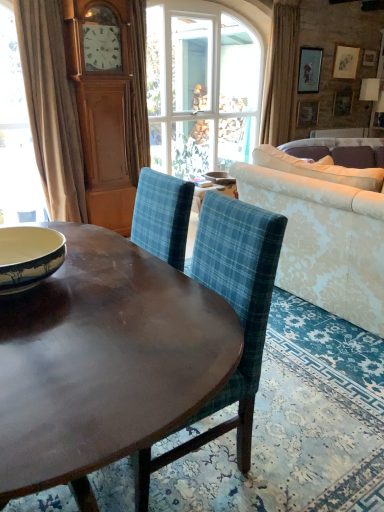
Question: Do you think shiny brown wood coffee table at center is within wooden picture frame at upper right, the 1th picture frame from the bottom, or outside of it?

Choices:
 (A) inside
 (B) outside

Answer: (B)

Question: From the image's perspective, is shiny brown wood coffee table at center located above or below wooden picture frame at upper right, the 1th picture frame from the bottom?

Choices:
 (A) below
 (B) above

Answer: (A)

Question: Based on their relative distances, which object is nearer to the beige fabric curtain at upper right, which is the first curtain from right to left?

Choices:
 (A) blue plaid fabric chair at center
 (B) damask fabric couch at right
 (C) clear glass window at center
 (D) blue and white ceramic bowl at left, marked as the 2th bowl in a back-to-front arrangement
 (E) white glossy bowl at center, acting as the second bowl starting from the bottom

Answer: (C)

Question: Which of these objects is positioned closest to the wooden picture frame at upper right, the 1th picture frame from the bottom?

Choices:
 (A) beige fabric curtain at left, the 1th curtain viewed from the front
 (B) matte wooden picture frame at upper right, marked as the first picture frame in a top-to-bottom arrangement
 (C) shiny brown wood coffee table at center
 (D) blue and white ceramic bowl at left, positioned as the 1th bowl in front-to-back order
 (E) clear glass window at center

Answer: (B)